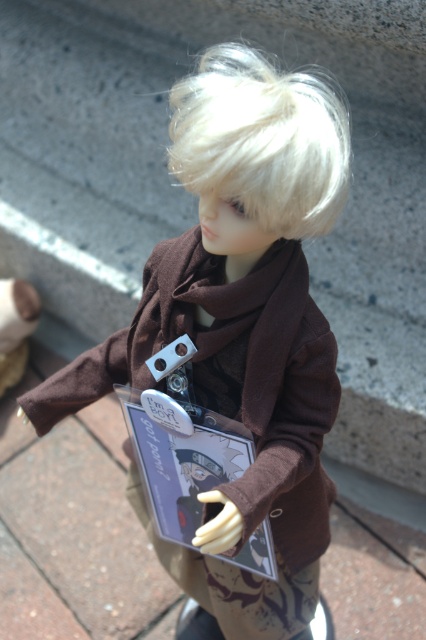
What is located at the coordinates point (x=241, y=324)?

The point (x=241, y=324) indicates the matte brown scarf at center.

You are a photographer standing at the camera position. You want to take a closeup shot of the doll. The point you need to focus on is point (x=193, y=154). If your camera has a focal length of 50mm, what is the minimum distance you need to be from the doll to achieve this focus?

The point (x=193, y=154) and camera are 70.99 centimeters apart, so the minimum distance you need to be from the doll to achieve focus is 70.99 centimeters.

You are a photographer trying to capture a closeup shot of the matte brown doll at center and the matte brown scarf at center. Your camera can only focus on objects within a 1 meter range. Will both objects be in focus?

The matte brown scarf at center and matte brown doll at center are 1.10 meters apart, so they are outside the camera focus range of 1 meter. Therefore, both objects cannot be in focus simultaneously.